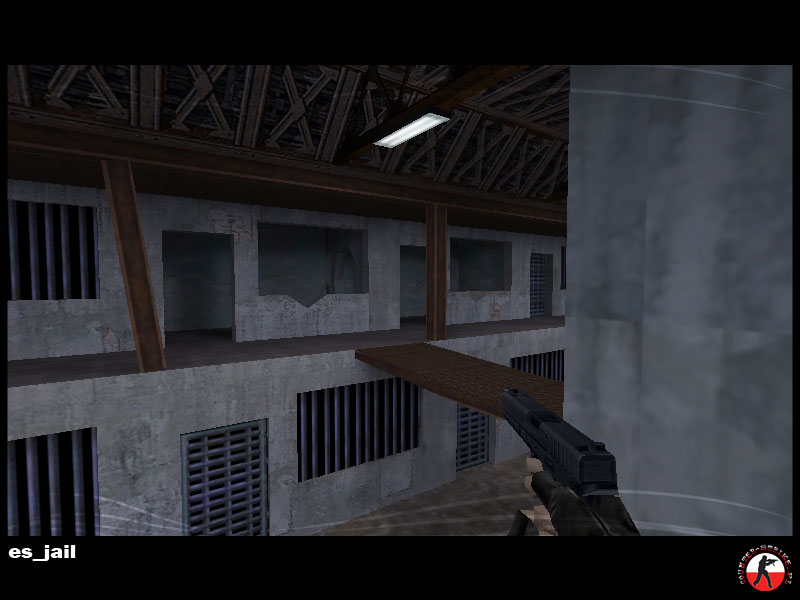
Find the location of a particular element. Image resolution: width=800 pixels, height=600 pixels. gated windows is located at coordinates (68, 276), (46, 483), (330, 451), (545, 368).